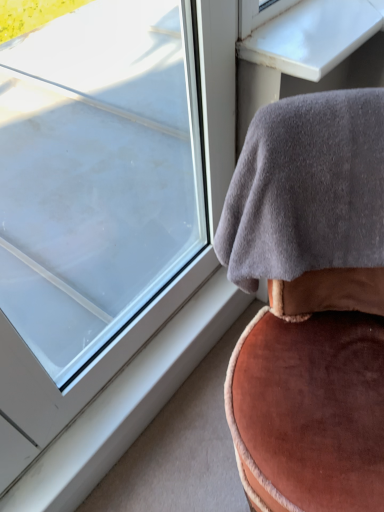
Question: From the image's perspective, is transparent glass window at upper left located beneath white glossy table at upper right?

Choices:
 (A) no
 (B) yes

Answer: (B)

Question: Is transparent glass window at upper left to the left of white glossy table at upper right from the viewer's perspective?

Choices:
 (A) no
 (B) yes

Answer: (B)

Question: Would you say transparent glass window at upper left is outside white glossy table at upper right?

Choices:
 (A) no
 (B) yes

Answer: (B)

Question: Is transparent glass window at upper left aimed at white glossy table at upper right?

Choices:
 (A) yes
 (B) no

Answer: (B)

Question: Is transparent glass window at upper left further to the viewer compared to white glossy table at upper right?

Choices:
 (A) no
 (B) yes

Answer: (A)

Question: Can you confirm if transparent glass window at upper left is smaller than white glossy table at upper right?

Choices:
 (A) yes
 (B) no

Answer: (B)

Question: Considering the relative sizes of white plastic window sill at lower left and white glossy table at upper right in the image provided, is white plastic window sill at lower left bigger than white glossy table at upper right?

Choices:
 (A) yes
 (B) no

Answer: (B)

Question: Does white plastic window sill at lower left have a lesser width compared to white glossy table at upper right?

Choices:
 (A) yes
 (B) no

Answer: (A)

Question: Is white plastic window sill at lower left not near white glossy table at upper right?

Choices:
 (A) no
 (B) yes

Answer: (A)

Question: Considering the relative sizes of white plastic window sill at lower left and white glossy table at upper right in the image provided, is white plastic window sill at lower left taller than white glossy table at upper right?

Choices:
 (A) no
 (B) yes

Answer: (A)

Question: Is white glossy table at upper right a part of white plastic window sill at lower left?

Choices:
 (A) no
 (B) yes

Answer: (A)

Question: From a real-world perspective, does white plastic window sill at lower left stand above white glossy table at upper right?

Choices:
 (A) no
 (B) yes

Answer: (A)

Question: Is transparent glass window at upper left at the right side of gray fleece blanket at upper right?

Choices:
 (A) yes
 (B) no

Answer: (B)